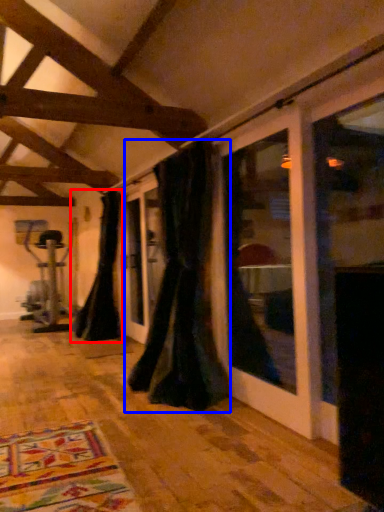
Question: Which object appears farthest to the camera in this image, curtain (highlighted by a red box) or curtain (highlighted by a blue box)?

Choices:
 (A) curtain
 (B) curtain

Answer: (A)